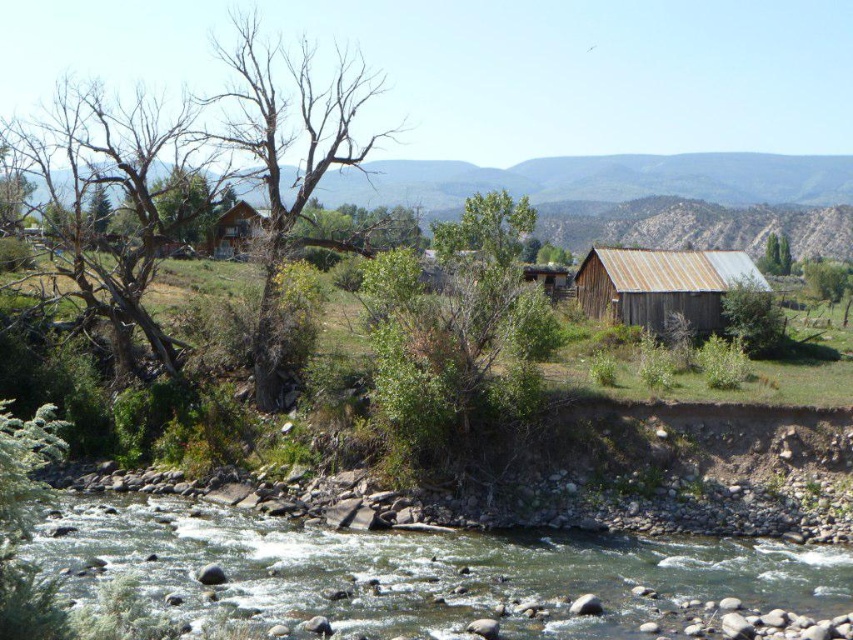
You are standing at the origin point of the image coordinate system. Which direction should you move to reach the bare wood tree at center?

You should move towards the point at coordinate 0.239 on the x axis and 0.336 on the y axis to reach the bare wood tree at center.